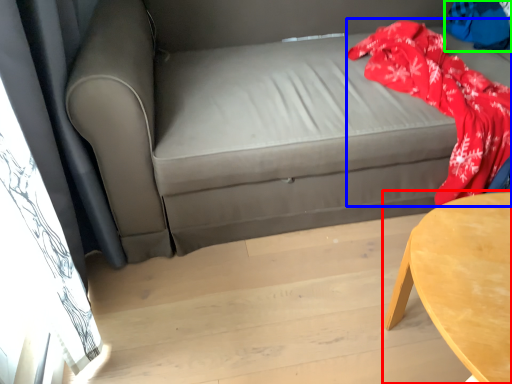
Question: Which object is the farthest from table (highlighted by a red box)? Choose among these: blanket (highlighted by a blue box) or clothing (highlighted by a green box).

Choices:
 (A) blanket
 (B) clothing

Answer: (B)